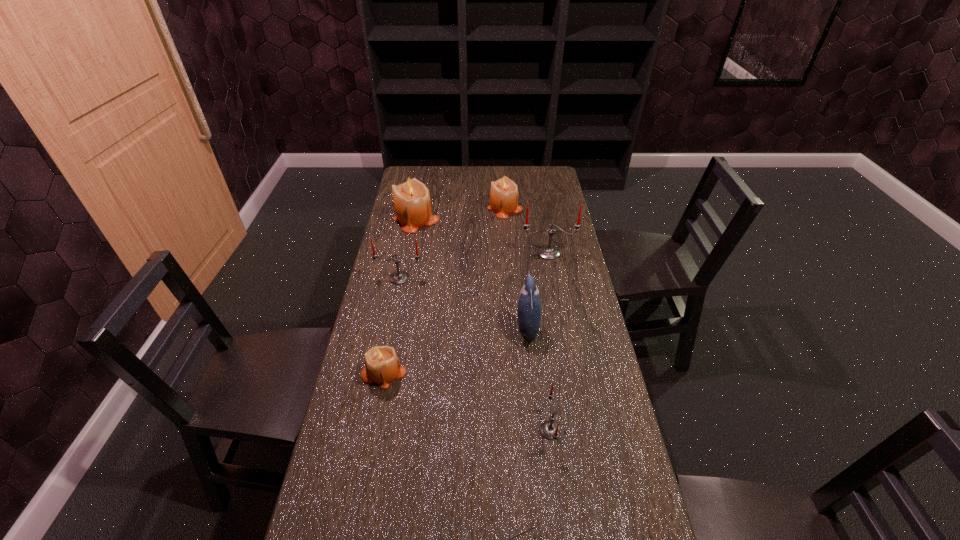
Locate an element on the screen. This screenshot has height=540, width=960. vacant region located 0.390m on the front-facing side of the nearest red candle is located at coordinates (392, 430).

Image resolution: width=960 pixels, height=540 pixels. Find the location of `vacant area located on the front-facing side of the nearest red candle`. vacant area located on the front-facing side of the nearest red candle is located at coordinates (483, 430).

Where is `free location located on the front of the smallest beige candle`? Image resolution: width=960 pixels, height=540 pixels. free location located on the front of the smallest beige candle is located at coordinates (360, 490).

Find the location of a particular element. object that is at the right edge is located at coordinates (548, 252).

At what (x,y) coordinates should I click in order to perform the action: click on free space at the far edge of the desktop. Please return your answer as a coordinate pair (x, y). This screenshot has height=540, width=960. Looking at the image, I should click on (506, 171).

At what (x,y) coordinates should I click in order to perform the action: click on free space at the left edge of the desktop. Please return your answer as a coordinate pair (x, y). The image size is (960, 540). Looking at the image, I should click on (403, 285).

This screenshot has width=960, height=540. Find the location of `vacant space at the right edge`. vacant space at the right edge is located at coordinates click(563, 408).

Where is `free space at the far right corner`? This screenshot has width=960, height=540. free space at the far right corner is located at coordinates (531, 168).

Where is `free space between the fourth farthest candle and the biggest beige candle`? free space between the fourth farthest candle and the biggest beige candle is located at coordinates (408, 248).

This screenshot has height=540, width=960. Identify the location of free space between the fifth farthest candle and the blue bird. tap(455, 350).